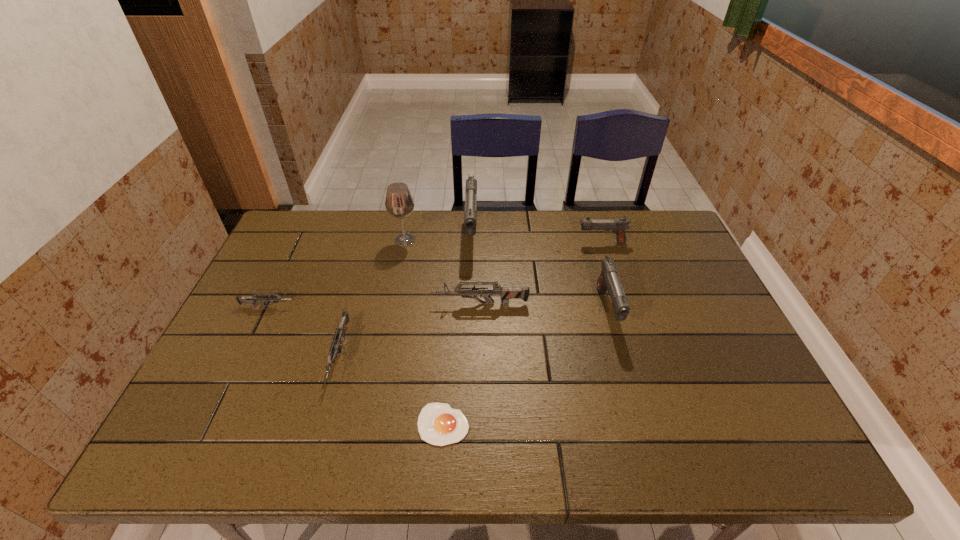
Identify the location of blank space at the far edge. The image size is (960, 540). (552, 225).

What are the coordinates of `vacant space at the near edge` in the screenshot? It's located at (479, 442).

I want to click on vacant space at the left edge of the desktop, so click(x=296, y=269).

Find the location of a particular element. The image size is (960, 540). vacant point at the right edge is located at coordinates click(714, 308).

I want to click on free point at the far right corner, so click(653, 244).

Find the location of a particular element. This screenshot has width=960, height=540. free point between the biggest grey gun and the egg yolk is located at coordinates (462, 364).

Image resolution: width=960 pixels, height=540 pixels. Identify the location of vacant area that lies between the smallest gray gun and the leftmost gray gun. (537, 238).

The height and width of the screenshot is (540, 960). In order to click on free area in between the third shortest gun and the third object from left to right in this screenshot , I will do `click(443, 272)`.

Find the location of a particular element. This screenshot has width=960, height=540. empty space between the fourth tallest object and the fifth gun from right to left is located at coordinates (470, 299).

Locate an element on the screen. The width and height of the screenshot is (960, 540). unoccupied position between the fourth shortest gun and the wineglass is located at coordinates (503, 241).